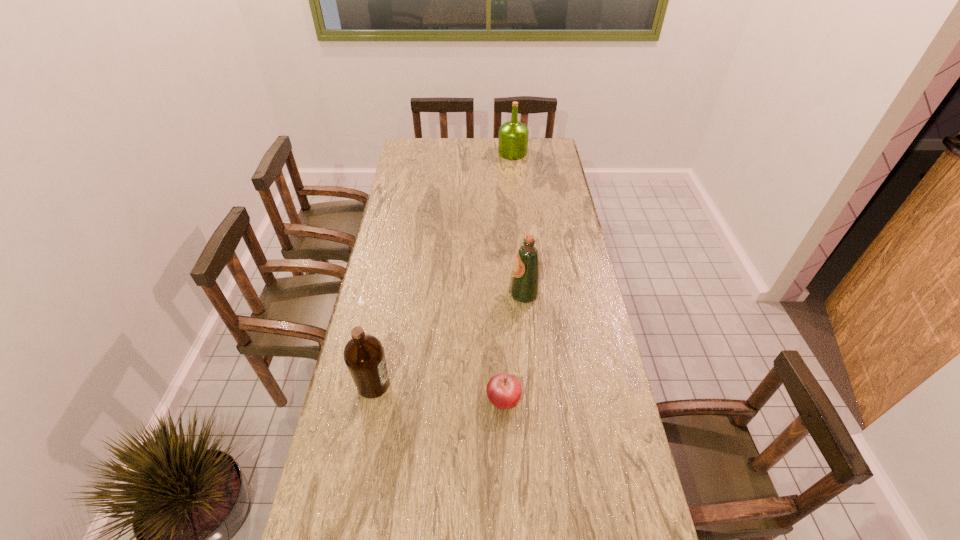
Locate an element on the screen. Image resolution: width=960 pixels, height=540 pixels. empty space between the farthest object and the nearest olive oil is located at coordinates (443, 268).

The height and width of the screenshot is (540, 960). Find the location of `free space between the apple and the farthest olive oil`. free space between the apple and the farthest olive oil is located at coordinates (508, 275).

I want to click on vacant area that lies between the farthest object and the leftmost object, so click(x=443, y=268).

You are a GUI agent. You are given a task and a screenshot of the screen. Output one action in this format:
    pyautogui.click(x=<x>, y=<y>)
    Task: Click on the vacant space that's between the nearest olive oil and the farthest object
    
    Given the screenshot: What is the action you would take?
    pyautogui.click(x=443, y=268)

The width and height of the screenshot is (960, 540). What are the coordinates of `free space between the second farthest object and the apple` in the screenshot? It's located at (514, 346).

Locate an element on the screen. The height and width of the screenshot is (540, 960). vacant point located between the leftmost object and the farthest object is located at coordinates (443, 268).

The width and height of the screenshot is (960, 540). What are the coordinates of `blank region between the second farthest object and the apple` in the screenshot? It's located at (514, 346).

Where is `free spot between the farthest olive oil and the leftmost olive oil`? free spot between the farthest olive oil and the leftmost olive oil is located at coordinates (443, 268).

The height and width of the screenshot is (540, 960). In order to click on vacant space in between the second nearest olive oil and the leftmost olive oil in this screenshot , I will do `click(448, 339)`.

Where is `free point between the leftmost object and the apple`? The height and width of the screenshot is (540, 960). free point between the leftmost object and the apple is located at coordinates (439, 392).